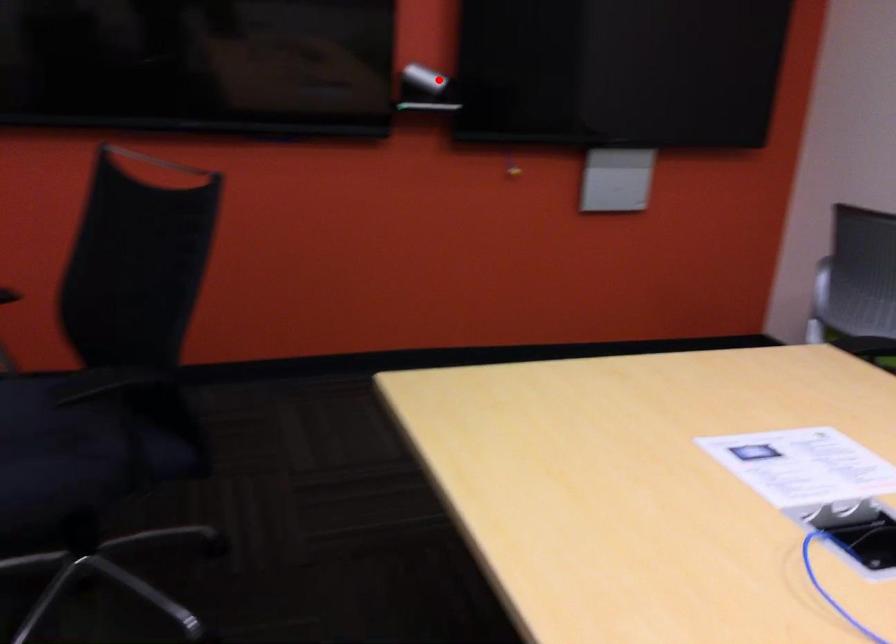
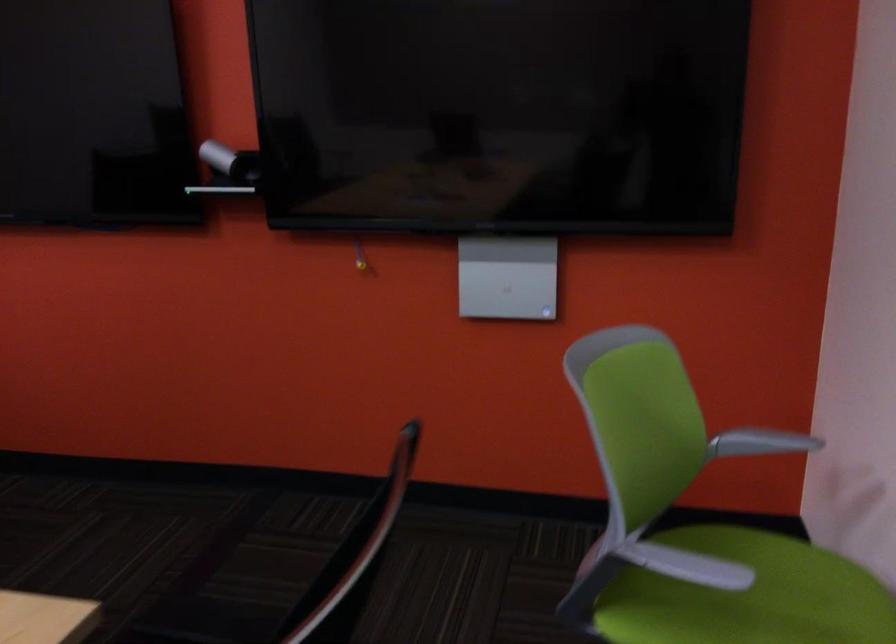
Where in the second image is the point corresponding to the highlighted location from the first image?

(230, 162)